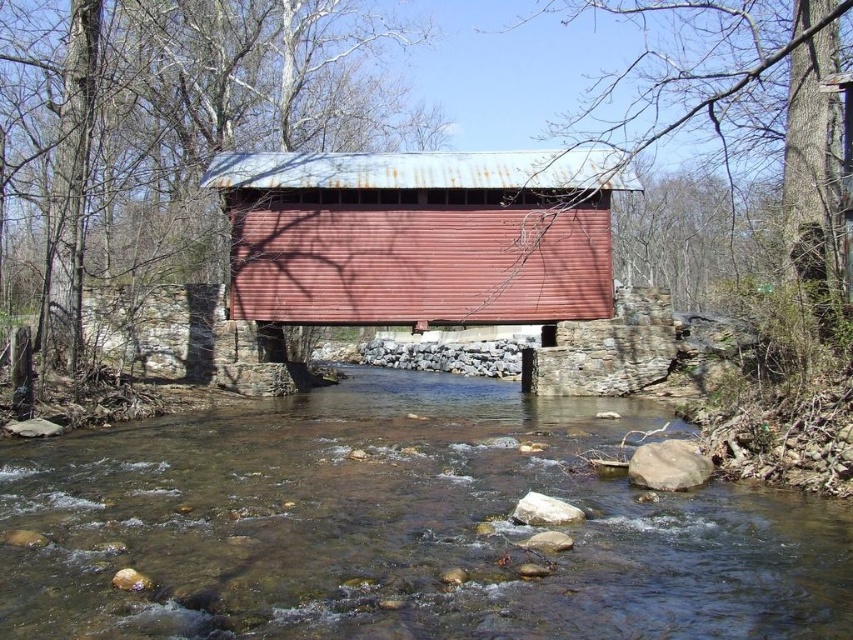
Question: Is clear water at center positioned in front of rusty metal bridge at center?

Choices:
 (A) no
 (B) yes

Answer: (B)

Question: Which point is farther from the camera taking this photo?

Choices:
 (A) (577, 240)
 (B) (91, 440)

Answer: (A)

Question: Is clear water at center positioned before rusty metal bridge at center?

Choices:
 (A) yes
 (B) no

Answer: (A)

Question: Does clear water at center appear under rusty metal bridge at center?

Choices:
 (A) no
 (B) yes

Answer: (B)